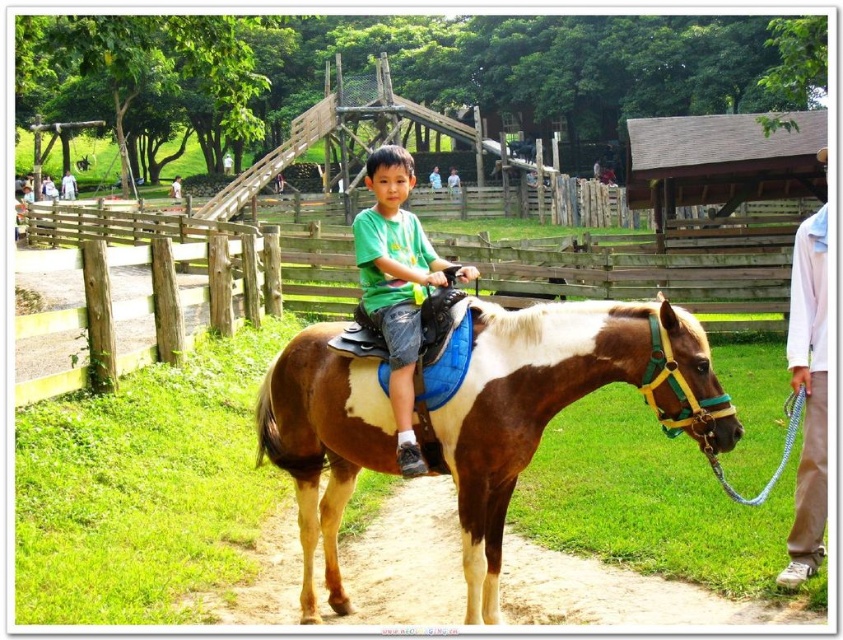
Question: Which object appears closest to the camera in this image?

Choices:
 (A) brown leather path at lower center
 (B) green matte shirt at center

Answer: (B)

Question: Does wooden fence at center appear on the left side of brown leather path at lower center?

Choices:
 (A) yes
 (B) no

Answer: (A)

Question: Which point appears closest to the camera in this image?

Choices:
 (A) (541, 321)
 (B) (414, 312)
 (C) (266, 259)
 (D) (803, 529)

Answer: (A)

Question: Which of the following is the farthest from the observer?

Choices:
 (A) brown leather path at lower center
 (B) green matte shirt at center

Answer: (A)

Question: Is brown glossy horse at center thinner than green matte shirt at center?

Choices:
 (A) no
 (B) yes

Answer: (A)

Question: Can you confirm if wooden fence at center is thinner than white shirt at right?

Choices:
 (A) no
 (B) yes

Answer: (A)